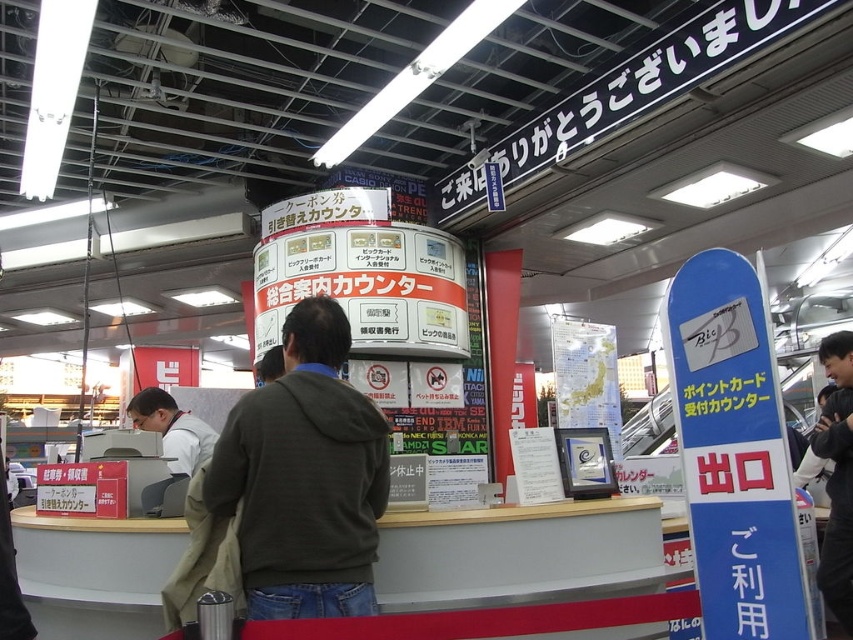
Question: Considering the relative positions of dark gray hoodie at center and white shirt at center in the image provided, where is dark gray hoodie at center located with respect to white shirt at center?

Choices:
 (A) above
 (B) below

Answer: (A)

Question: Which of the following is the closest to the observer?

Choices:
 (A) (285, 321)
 (B) (207, 428)

Answer: (B)

Question: Which point is closer to the camera taking this photo?

Choices:
 (A) (172, 451)
 (B) (315, 449)

Answer: (B)

Question: Which of the following is the closest to the observer?

Choices:
 (A) white shirt at center
 (B) dark gray hoodie at center

Answer: (B)

Question: Is dark gray hoodie at center below white shirt at center?

Choices:
 (A) no
 (B) yes

Answer: (A)

Question: Is dark gray hoodie at center wider than white shirt at center?

Choices:
 (A) yes
 (B) no

Answer: (A)